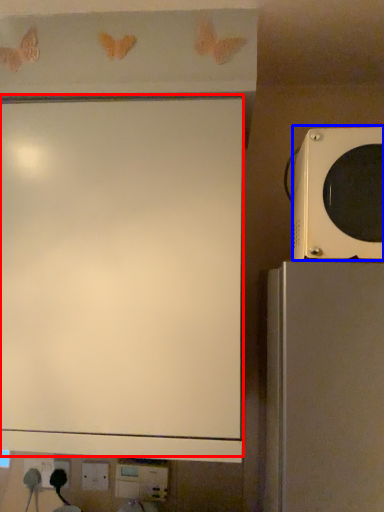
Question: Which object is closer to the camera taking this photo, projection screen (highlighted by a red box) or microwave oven (highlighted by a blue box)?

Choices:
 (A) projection screen
 (B) microwave oven

Answer: (B)